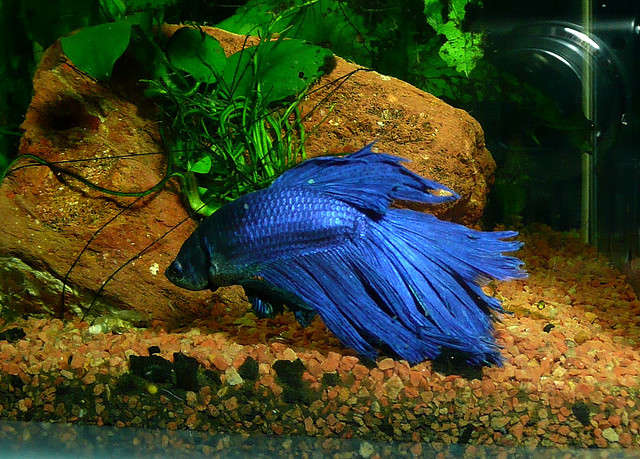
Identify the location of scales. (290, 214).